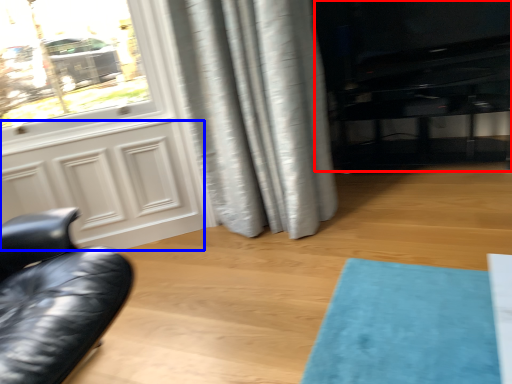
Question: Which of the following is the farthest to the observer, entertainment center (highlighted by a red box) or screen door (highlighted by a blue box)?

Choices:
 (A) entertainment center
 (B) screen door

Answer: (A)